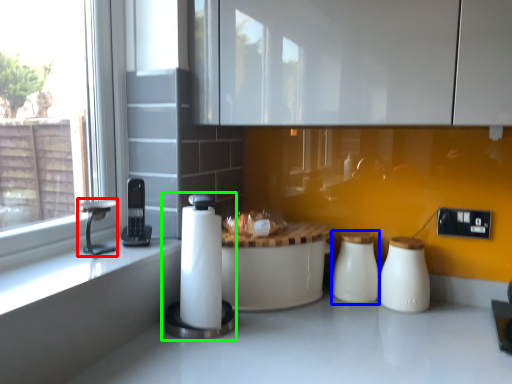
Question: Estimate the real-world distances between objects in this image. Which object is closer to faucet (highlighted by a red box), salt shaker (highlighted by a blue box) or appliance (highlighted by a green box)?

Choices:
 (A) salt shaker
 (B) appliance

Answer: (B)